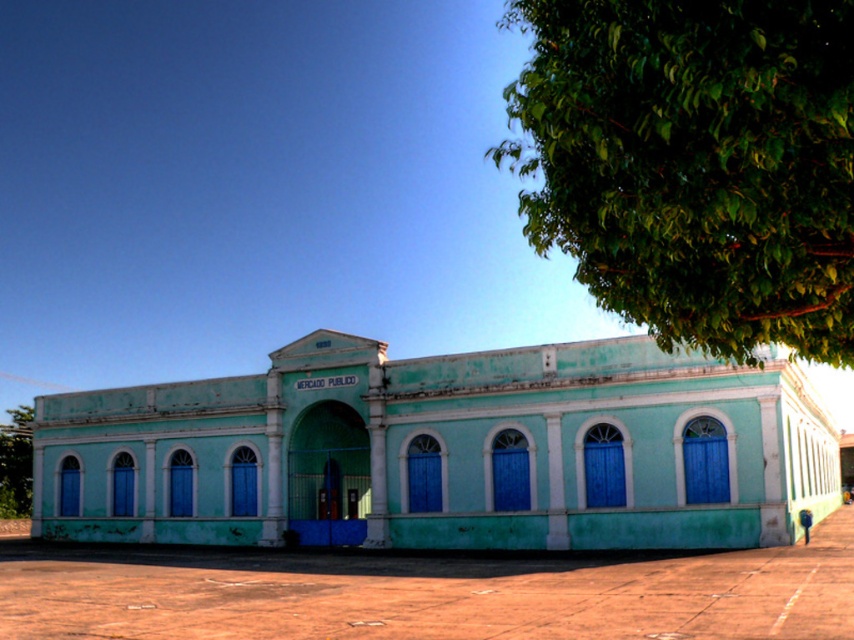
Does green leafy tree at upper right have a lesser height compared to green leafy tree at lower left?

No, green leafy tree at upper right is not shorter than green leafy tree at lower left.

Is point (793, 314) farther from camera compared to point (30, 472)?

No, (793, 314) is closer to viewer.

At what (x,y) coordinates should I click in order to perform the action: click on green leafy tree at upper right. Please return your answer as a coordinate pair (x, y). The height and width of the screenshot is (640, 854). Looking at the image, I should click on (695, 164).